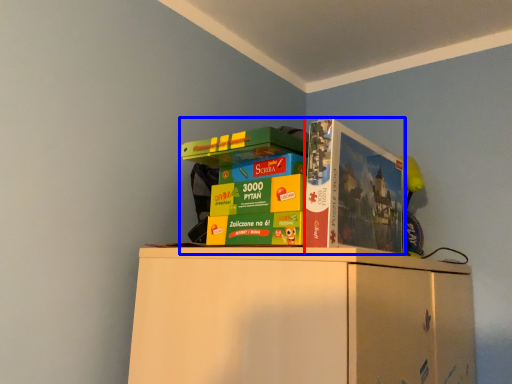
Question: Which of the following is the farthest to the observer, paperback book (highlighted by a red box) or collection (highlighted by a blue box)?

Choices:
 (A) paperback book
 (B) collection

Answer: (A)